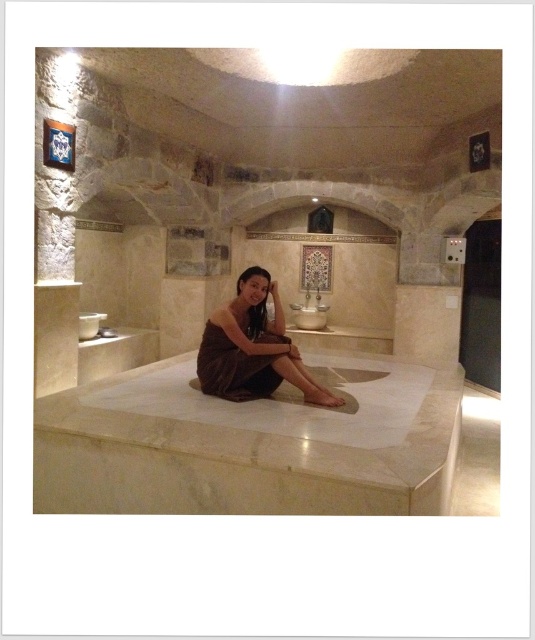
Is white marble bathtub at center positioned behind brown fabric at center?

No, it is in front of brown fabric at center.

Does white marble bathtub at center appear on the left side of brown fabric at center?

Yes, white marble bathtub at center is to the left of brown fabric at center.

Does point (65, 404) lie behind point (203, 332)?

No, (65, 404) is in front of (203, 332).

At what (x,y) coordinates should I click in order to perform the action: click on white marble bathtub at center. Please return your answer as a coordinate pair (x, y). This screenshot has height=640, width=535. Looking at the image, I should click on (251, 444).

Who is positioned more to the left, brown fabric at center or brown satin dress at center?

Positioned to the left is brown satin dress at center.

Does brown fabric at center have a lesser height compared to brown satin dress at center?

In fact, brown fabric at center may be taller than brown satin dress at center.

Between point (212, 348) and point (240, 401), which one is positioned in front?

Point (240, 401) is more forward.

Find the location of a particular element. The height and width of the screenshot is (640, 535). brown fabric at center is located at coordinates (253, 348).

Based on the photo, does white marble bathtub at center have a lesser width compared to brown satin dress at center?

No, white marble bathtub at center is not thinner than brown satin dress at center.

Can you confirm if white marble bathtub at center is wider than brown satin dress at center?

Indeed, white marble bathtub at center has a greater width compared to brown satin dress at center.

Is point (194, 420) closer to camera compared to point (250, 360)?

Yes, it is in front of point (250, 360).

At what (x,y) coordinates should I click in order to perform the action: click on white marble bathtub at center. Please return your answer as a coordinate pair (x, y). The image size is (535, 640). Looking at the image, I should click on (251, 444).